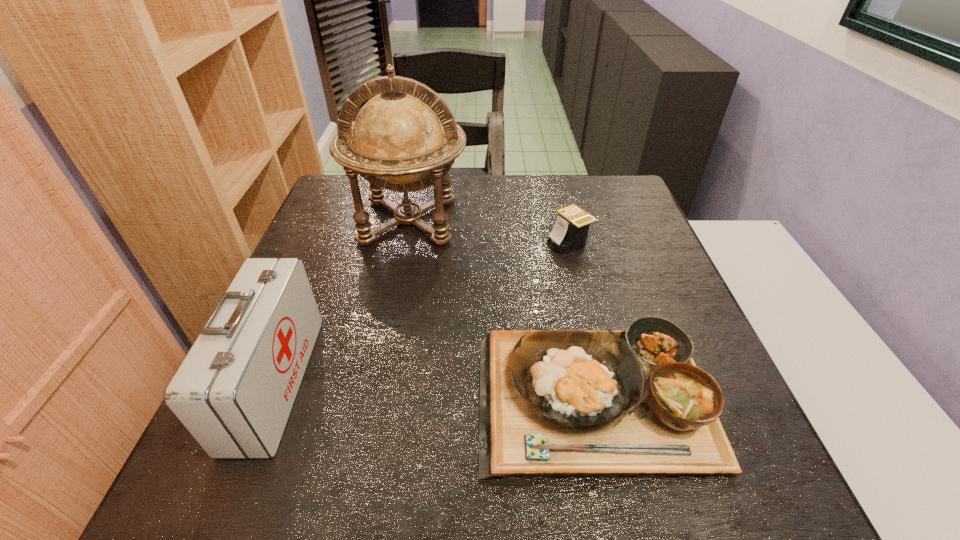
The image size is (960, 540). I want to click on free space between the third shortest object and the globe, so click(342, 301).

Identify which object is located as the nearest to the first-aid kit. Please provide its 2D coordinates. Your answer should be formatted as a tuple, i.e. [(x, y)], where the tuple contains the x and y coordinates of a point satisfying the conditions above.

[(404, 139)]

Identify which object is located as the second nearest to the first-aid kit. Please provide its 2D coordinates. Your answer should be formatted as a tuple, i.e. [(x, y)], where the tuple contains the x and y coordinates of a point satisfying the conditions above.

[(613, 403)]

The width and height of the screenshot is (960, 540). I want to click on free space that satisfies the following two spatial constraints: 1. on the front-facing side of the second tallest object; 2. on the back side of the platter, so click(x=269, y=397).

Find the location of a particular element. free location that satisfies the following two spatial constraints: 1. on the front-facing side of the globe; 2. on the right side of the calculator is located at coordinates (404, 242).

Find the location of `blank area in the image that satisfies the following two spatial constraints: 1. on the back side of the platter; 2. on the front-facing side of the first-aid kit`. blank area in the image that satisfies the following two spatial constraints: 1. on the back side of the platter; 2. on the front-facing side of the first-aid kit is located at coordinates (595, 382).

Identify the location of free space in the image that satisfies the following two spatial constraints: 1. on the back side of the platter; 2. on the right side of the calculator. This screenshot has height=540, width=960. (563, 242).

Where is `free region that satisfies the following two spatial constraints: 1. on the front-facing side of the globe; 2. on the right side of the platter`? The image size is (960, 540). free region that satisfies the following two spatial constraints: 1. on the front-facing side of the globe; 2. on the right side of the platter is located at coordinates (372, 397).

Where is `blank area in the image that satisfies the following two spatial constraints: 1. on the front-facing side of the first-aid kit; 2. on the back side of the platter`? blank area in the image that satisfies the following two spatial constraints: 1. on the front-facing side of the first-aid kit; 2. on the back side of the platter is located at coordinates (269, 397).

Identify the location of vacant space that satisfies the following two spatial constraints: 1. on the back side of the calculator; 2. on the right side of the platter. (563, 242).